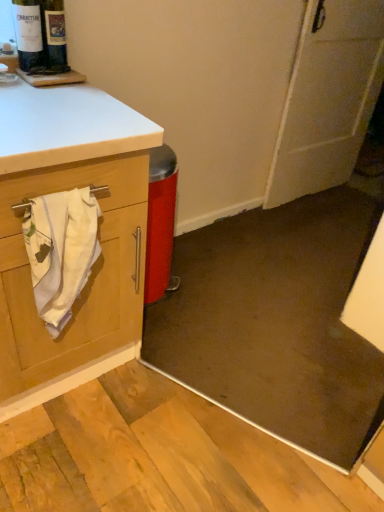
Question: Considering the relative sizes of white cotton towel at left and matte glass wine bottle at upper left in the image provided, is white cotton towel at left bigger than matte glass wine bottle at upper left?

Choices:
 (A) yes
 (B) no

Answer: (A)

Question: From the image's perspective, would you say white cotton towel at left is shown under matte glass wine bottle at upper left?

Choices:
 (A) no
 (B) yes

Answer: (B)

Question: Can matte glass wine bottle at upper left be found inside white cotton towel at left?

Choices:
 (A) no
 (B) yes

Answer: (A)

Question: Is white cotton towel at left wider than matte glass wine bottle at upper left?

Choices:
 (A) yes
 (B) no

Answer: (A)

Question: From the image's perspective, is white cotton towel at left above matte glass wine bottle at upper left?

Choices:
 (A) no
 (B) yes

Answer: (A)

Question: From a real-world perspective, is white cotton towel at left below matte glass wine bottle at upper left?

Choices:
 (A) no
 (B) yes

Answer: (B)

Question: Can you confirm if white matte door at upper right is shorter than matte glass wine bottle at upper left?

Choices:
 (A) no
 (B) yes

Answer: (A)

Question: From the image's perspective, would you say white matte door at upper right is positioned over matte glass wine bottle at upper left?

Choices:
 (A) yes
 (B) no

Answer: (A)

Question: Considering the relative sizes of white matte door at upper right and matte glass wine bottle at upper left in the image provided, is white matte door at upper right thinner than matte glass wine bottle at upper left?

Choices:
 (A) no
 (B) yes

Answer: (A)

Question: Is matte glass wine bottle at upper left a part of white matte door at upper right?

Choices:
 (A) yes
 (B) no

Answer: (B)

Question: Is the depth of white matte door at upper right less than that of matte glass wine bottle at upper left?

Choices:
 (A) yes
 (B) no

Answer: (B)

Question: Is white matte door at upper right smaller than matte glass wine bottle at upper left?

Choices:
 (A) no
 (B) yes

Answer: (A)

Question: Can you confirm if white matte door at upper right is smaller than white cotton towel at left?

Choices:
 (A) no
 (B) yes

Answer: (A)